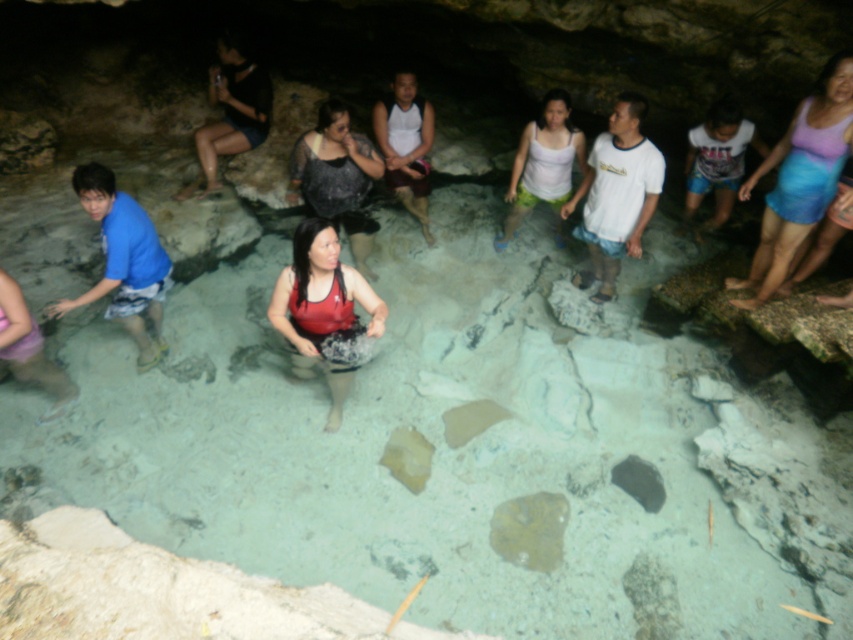
Based on the photo, you are standing at the edge of the natural pool and want to reach both the point at coordinates point (305, 144) and the point at coordinates point (567, 131). Which point should you reach first to minimize the distance walked?

You should reach point (305, 144) first because it is closer to you than point (567, 131).

You are a tour guide leading a group to the pool area. You need to ensure that all visitors maintain a minimum distance of 2 meters between each other for safety. Are the matte red tank top at center and the matte black dress at center complying with this rule?

The matte red tank top at center is 1.50 meters from the matte black dress at center, which is less than the required 2 meters. Therefore, they are not complying with the safety distance rule.

From the picture: You are standing at the entrance of the cave, looking towards the natural pool. Where exactly is the matte red tank top at center located in relation to the entrance?

The matte red tank top at center is located at coordinates point (x=323, y=310) relative to the entrance.